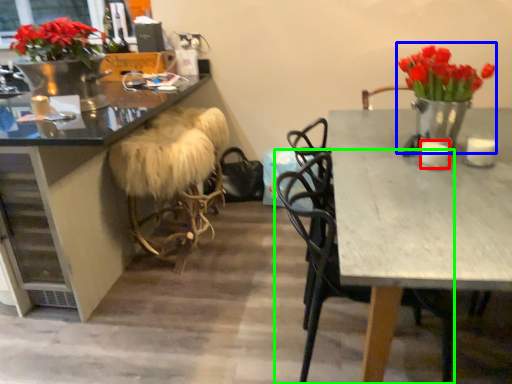
Question: Which is farther away from candle (highlighted by a red box)? floral arrangement (highlighted by a blue box) or chair (highlighted by a green box)?

Choices:
 (A) floral arrangement
 (B) chair

Answer: (B)